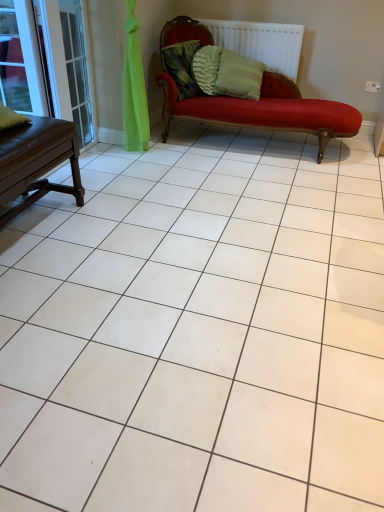
What are the coordinates of `white textured radiator at upper center` in the screenshot? It's located at (261, 42).

Locate an element on the screen. The height and width of the screenshot is (512, 384). textured green pillow at center, the first pillow viewed from the right is located at coordinates (206, 68).

The height and width of the screenshot is (512, 384). Identify the location of brown wooden table at left. (36, 161).

Looking at this image, considering the sizes of objects clear glass window at upper left and textured green pillow at center, which appears as the 2th pillow when viewed from the left, in the image provided, who is thinner, clear glass window at upper left or textured green pillow at center, which appears as the 2th pillow when viewed from the left,?

clear glass window at upper left.

Looking at the image, does clear glass window at upper left seem bigger or smaller compared to textured green pillow at center, the first pillow viewed from the right?

clear glass window at upper left is smaller than textured green pillow at center, the first pillow viewed from the right.

Is clear glass window at upper left outside of textured green pillow at center, the first pillow viewed from the right?

clear glass window at upper left lies outside textured green pillow at center, the first pillow viewed from the right,'s area.

Looking at this image, is clear glass screen door at left turned away from textured green pillow at upper center, which is the 1th pillow from left to right?

No, clear glass screen door at left is not facing the opposite direction of textured green pillow at upper center, which is the 1th pillow from left to right.

Who is more distant, clear glass screen door at left or textured green pillow at upper center, which is the 2th pillow in right-to-left order?

textured green pillow at upper center, which is the 2th pillow in right-to-left order, is further away from the camera.

From the image's perspective, is white textured radiator at upper center positioned above or below clear glass window at upper left?

white textured radiator at upper center is above clear glass window at upper left.

Can you tell me how much white textured radiator at upper center and clear glass window at upper left differ in facing direction?

0.684 degrees separate the facing orientations of white textured radiator at upper center and clear glass window at upper left.

Between white textured radiator at upper center and clear glass window at upper left, which one has less height?

white textured radiator at upper center.

Is white textured radiator at upper center located outside clear glass window at upper left?

Yes, white textured radiator at upper center is outside of clear glass window at upper left.

Is there a large distance between brown wooden table at left and clear glass screen door at left?

brown wooden table at left is actually quite close to clear glass screen door at left.

From a real-world perspective, does brown wooden table at left sit lower than clear glass screen door at left?

Yes.

Looking at this image, is brown wooden table at left at the right side of clear glass screen door at left?

No, brown wooden table at left is not to the right of clear glass screen door at left.

From the image's perspective, is brown wooden table at left located above or below clear glass screen door at left?

brown wooden table at left is situated lower than clear glass screen door at left in the image.

Is point (285, 51) less distant than point (164, 58)?

No, it is behind (164, 58).

Does white textured radiator at upper center lie behind textured green pillow at upper center, which is the 1th pillow from left to right?

Yes, it is behind textured green pillow at upper center, which is the 1th pillow from left to right.

Who is shorter, white textured radiator at upper center or textured green pillow at upper center, which is the 2th pillow in right-to-left order?

textured green pillow at upper center, which is the 2th pillow in right-to-left order.

Is textured green pillow at upper center, which is the 1th pillow from left to right, at the back of white textured radiator at upper center?

That's not correct — white textured radiator at upper center is not looking away from textured green pillow at upper center, which is the 1th pillow from left to right.

Is clear glass window at upper left bigger or smaller than brown wooden table at left?

clear glass window at upper left is smaller than brown wooden table at left.

Does clear glass window at upper left come behind brown wooden table at left?

Yes, clear glass window at upper left is behind brown wooden table at left.

You are a GUI agent. You are given a task and a screenshot of the screen. Output one action in this format:
    pyautogui.click(x=<x>, y=<y>)
    Task: Click on the table below the clear glass window at upper left (from the image's perspective)
    This screenshot has width=384, height=512.
    Given the screenshot: What is the action you would take?
    pyautogui.click(x=36, y=161)

In the scene shown: Is clear glass window at upper left oriented away from brown wooden table at left?

clear glass window at upper left is not turned away from brown wooden table at left.

From the image's perspective, which is below, textured green pillow at center, which appears as the 2th pillow when viewed from the left, or brown wooden table at left?

brown wooden table at left.

In the scene shown: How many degrees apart are the facing directions of textured green pillow at center, which appears as the 2th pillow when viewed from the left, and brown wooden table at left?

48 degrees separate the facing orientations of textured green pillow at center, which appears as the 2th pillow when viewed from the left, and brown wooden table at left.

Is textured green pillow at center, the first pillow viewed from the right, beside brown wooden table at left?

No.

The width and height of the screenshot is (384, 512). In the image, there is a textured green pillow at center, which appears as the 2th pillow when viewed from the left. What are the coordinates of `window below it (from the image's perspective)` in the screenshot? It's located at (21, 60).

From the image's perspective, starting from the clear glass screen door at left, which pillow is the 1st one above? Please provide its 2D coordinates.

[(182, 67)]

Which object lies nearer to the anchor point brown wooden table at left, clear glass screen door at left or clear glass window at upper left?

Based on the image, clear glass window at upper left appears to be nearer to brown wooden table at left.

When comparing their distances from textured green pillow at center, the first pillow viewed from the right, does textured green pillow at upper center, which is the 1th pillow from left to right, or brown wooden table at left seem further?

brown wooden table at left.

Considering their positions, is clear glass window at upper left positioned further to textured green pillow at upper center, which is the 2th pillow in right-to-left order, than textured green pillow at center, the first pillow viewed from the right?

clear glass window at upper left lies further to textured green pillow at upper center, which is the 2th pillow in right-to-left order, than the other object.

When comparing their distances from clear glass screen door at left, does white textured radiator at upper center or textured green pillow at upper center, which is the 2th pillow in right-to-left order, seem closer?

textured green pillow at upper center, which is the 2th pillow in right-to-left order, is positioned closer to the anchor clear glass screen door at left.

When comparing their distances from white textured radiator at upper center, does textured green pillow at center, the first pillow viewed from the right, or clear glass window at upper left seem closer?

textured green pillow at center, the first pillow viewed from the right, is positioned closer to the anchor white textured radiator at upper center.

Looking at this image, which object lies nearer to the anchor point white textured radiator at upper center, clear glass window at upper left or textured green pillow at center, the first pillow viewed from the right?

textured green pillow at center, the first pillow viewed from the right, lies closer to white textured radiator at upper center than the other object.

From the image, which object appears to be farther from clear glass window at upper left, clear glass screen door at left or brown wooden table at left?

brown wooden table at left is positioned further to the anchor clear glass window at upper left.

Considering their positions, is textured green pillow at center, the first pillow viewed from the right, positioned closer to textured green pillow at upper center, which is the 1th pillow from left to right, than clear glass screen door at left?

textured green pillow at center, the first pillow viewed from the right, is closer to textured green pillow at upper center, which is the 1th pillow from left to right.

You are a GUI agent. You are given a task and a screenshot of the screen. Output one action in this format:
    pyautogui.click(x=<x>, y=<y>)
    Task: Click on the pillow between textured green pillow at upper center, which is the 2th pillow in right-to-left order, and white textured radiator at upper center from left to right
    The width and height of the screenshot is (384, 512).
    Given the screenshot: What is the action you would take?
    pyautogui.click(x=206, y=68)

Find the location of a particular element. The width and height of the screenshot is (384, 512). screen door situated between clear glass window at upper left and white textured radiator at upper center from left to right is located at coordinates (69, 64).

The height and width of the screenshot is (512, 384). Find the location of `screen door between clear glass window at upper left and textured green pillow at center, which appears as the 2th pillow when viewed from the left, from left to right`. screen door between clear glass window at upper left and textured green pillow at center, which appears as the 2th pillow when viewed from the left, from left to right is located at coordinates (69, 64).

Locate an element on the screen. This screenshot has width=384, height=512. pillow between brown wooden table at left and textured green pillow at center, which appears as the 2th pillow when viewed from the left, along the z-axis is located at coordinates (182, 67).